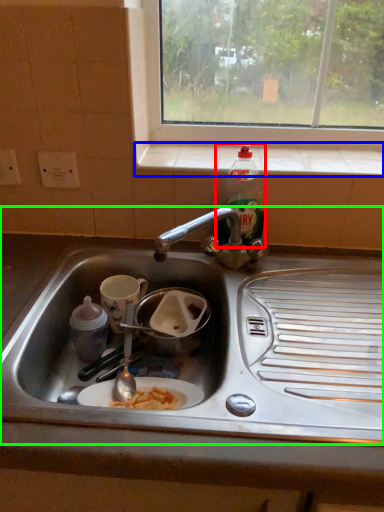
Question: Which is farther away from bottle (highlighted by a red box)? window sill (highlighted by a blue box) or sink (highlighted by a green box)?

Choices:
 (A) window sill
 (B) sink

Answer: (B)